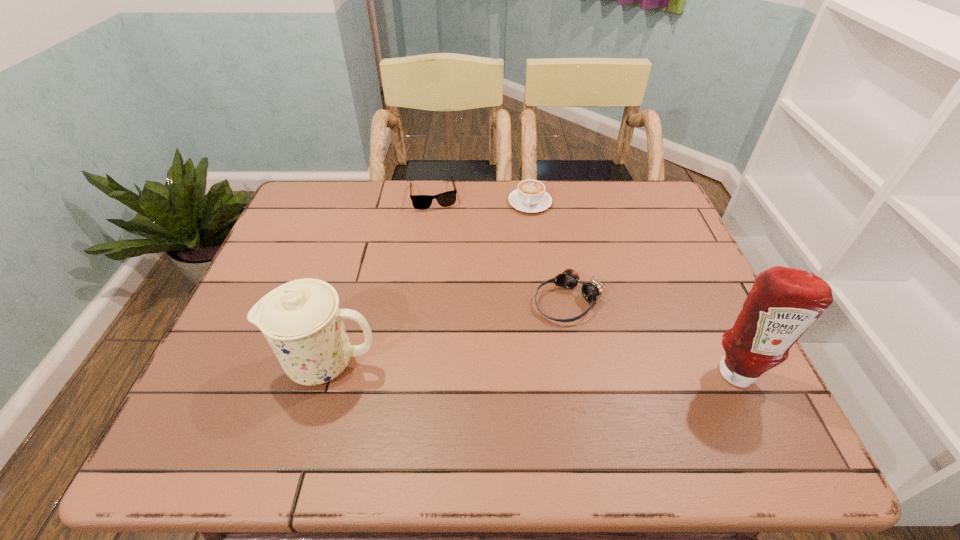
The width and height of the screenshot is (960, 540). Find the location of `free spot between the fourth shortest object and the cappuccino`. free spot between the fourth shortest object and the cappuccino is located at coordinates (428, 283).

Find the location of a particular element. object that is the nearest to the goggles is located at coordinates (783, 303).

This screenshot has width=960, height=540. Identify the location of object that is the second closest to the rightmost object. (530, 196).